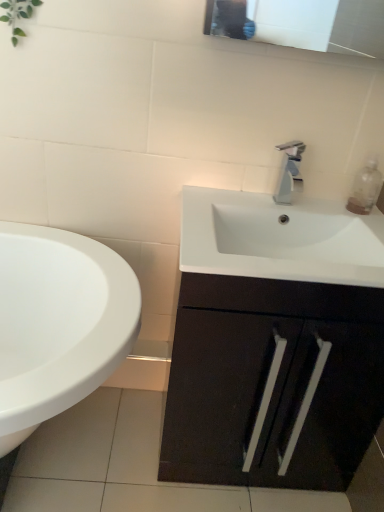
Where is `vacant space situated on the left part of silver metallic faucet at center`? The height and width of the screenshot is (512, 384). vacant space situated on the left part of silver metallic faucet at center is located at coordinates (242, 204).